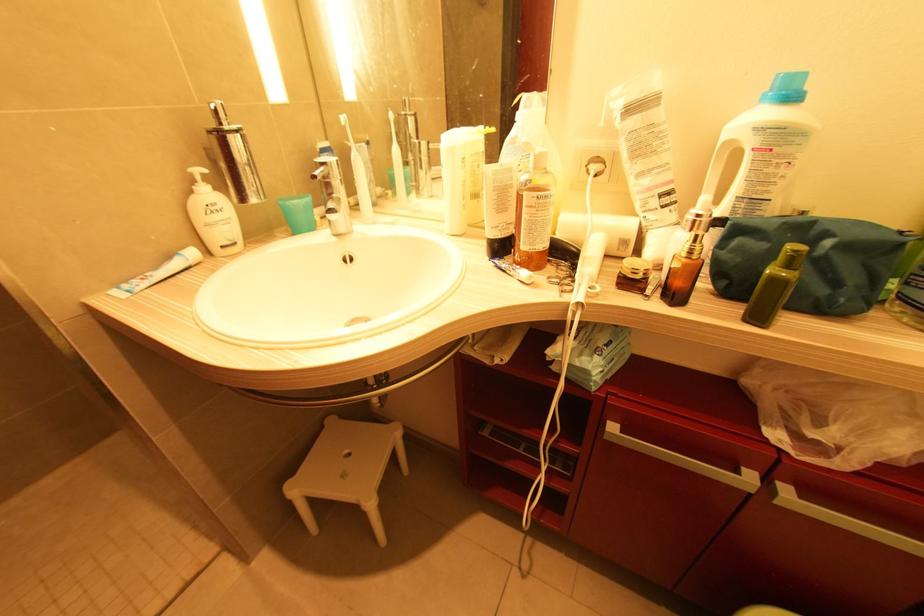
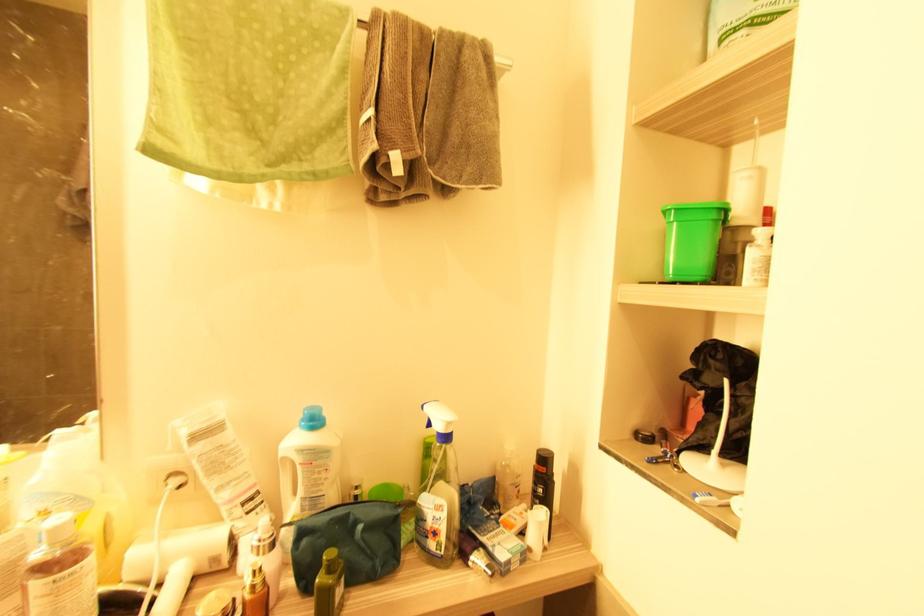
First-person continuous shooting, in which direction is the camera rotating?

The camera rotated toward right-up.